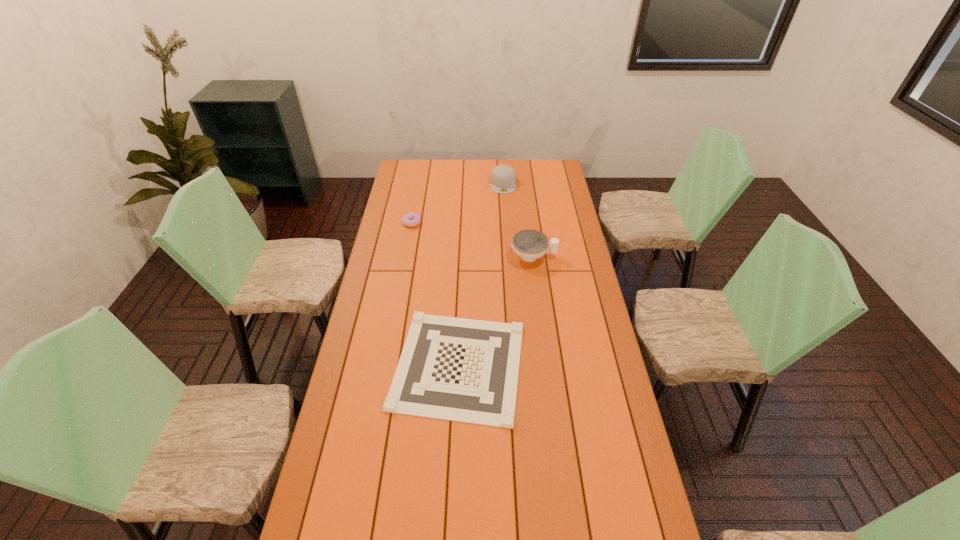
This screenshot has width=960, height=540. Identify the location of chinaware. (530, 245).

Image resolution: width=960 pixels, height=540 pixels. I want to click on the farthest object, so pos(503,178).

Locate an element on the screen. This screenshot has width=960, height=540. the second shortest object is located at coordinates (412, 219).

You are a GUI agent. You are given a task and a screenshot of the screen. Output one action in this format:
    pyautogui.click(x=<x>, y=<y>)
    Task: Click on the second farthest object
    The width and height of the screenshot is (960, 540).
    Given the screenshot: What is the action you would take?
    pyautogui.click(x=412, y=219)

Identify the location of the shortest object. (465, 370).

Find the location of a particular element. The height and width of the screenshot is (540, 960). the nearest object is located at coordinates (465, 370).

You are a GUI agent. You are given a task and a screenshot of the screen. Output one action in this format:
    pyautogui.click(x=<x>, y=<y>)
    Task: Click on the vacant space situated 0.120m on the side with the handle of the chinaware
    This screenshot has height=540, width=960.
    Given the screenshot: What is the action you would take?
    pyautogui.click(x=585, y=256)

Locate an element on the screen. This screenshot has width=960, height=540. free location located on the front-facing side of the farthest object is located at coordinates (506, 223).

At what (x,y) coordinates should I click in order to perform the action: click on vacant space located on the back of the doughnut. Please return your answer as a coordinate pair (x, y). Looking at the image, I should click on (418, 193).

Find the location of `vacant space situated 0.200m on the back of the checkerboard`. vacant space situated 0.200m on the back of the checkerboard is located at coordinates (462, 278).